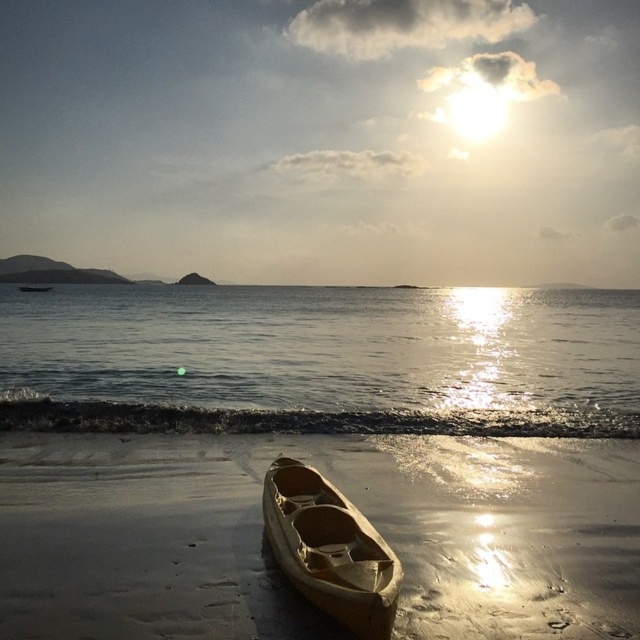
Question: Based on their relative distances, which object is farther from the wooden canoe at center?

Choices:
 (A) clear water at lower center
 (B) smooth sand at lower center

Answer: (A)

Question: Is clear water at lower center thinner than wooden canoe at center?

Choices:
 (A) no
 (B) yes

Answer: (A)

Question: Which object is the closest to the clear water at lower center?

Choices:
 (A) wooden canoe at center
 (B) smooth sand at lower center

Answer: (B)

Question: Is clear water at lower center wider than wooden canoe at center?

Choices:
 (A) yes
 (B) no

Answer: (A)

Question: Which of these objects is positioned closest to the wooden canoe at center?

Choices:
 (A) clear water at lower center
 (B) smooth sand at lower center

Answer: (B)

Question: Is smooth sand at lower center to the left of wooden canoe at center from the viewer's perspective?

Choices:
 (A) no
 (B) yes

Answer: (B)